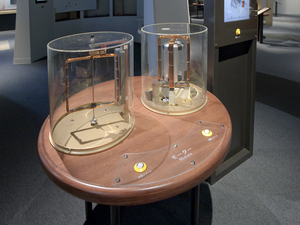
This screenshot has height=225, width=300. Find the location of `light`. light is located at coordinates pos(8,43).